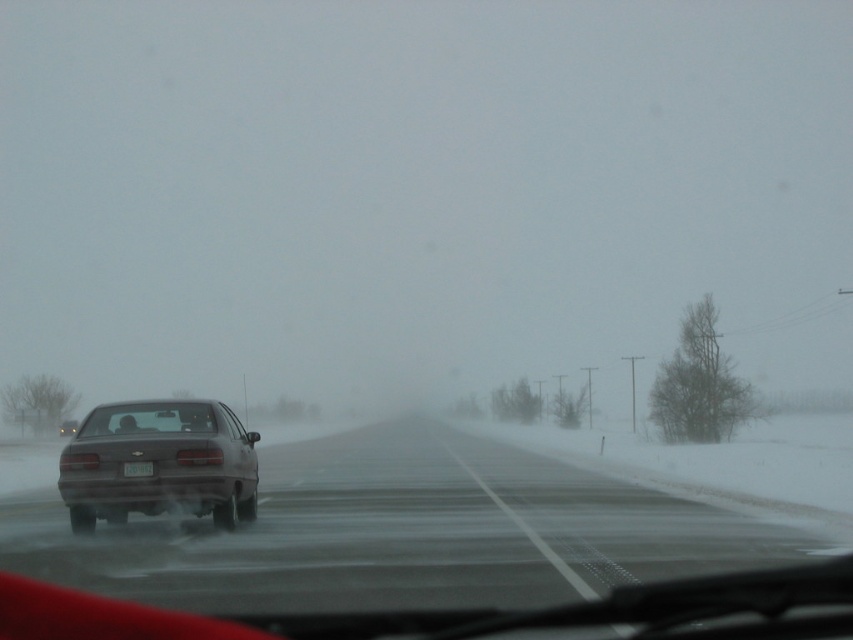
Question: Is smokey asphalt highway at center below matte gray sedan at center?

Choices:
 (A) no
 (B) yes

Answer: (B)

Question: Can you confirm if transparent glass windshield at center is positioned to the left of white plastic license plate at center?

Choices:
 (A) yes
 (B) no

Answer: (A)

Question: Among these points, which one is farthest from the camera?

Choices:
 (A) (170, 401)
 (B) (132, 461)
 (C) (434, 561)
 (D) (189, 413)

Answer: (A)

Question: Considering the real-world distances, which object is farthest from the matte gray sedan at center?

Choices:
 (A) transparent glass windshield at center
 (B) smokey asphalt highway at center

Answer: (B)

Question: Estimate the real-world distances between objects in this image. Which object is farther from the transparent glass windshield at center?

Choices:
 (A) white plastic license plate at center
 (B) smokey asphalt highway at center
 (C) matte gray sedan at center

Answer: (B)

Question: Does smokey asphalt highway at center come in front of transparent glass windshield at center?

Choices:
 (A) yes
 (B) no

Answer: (A)